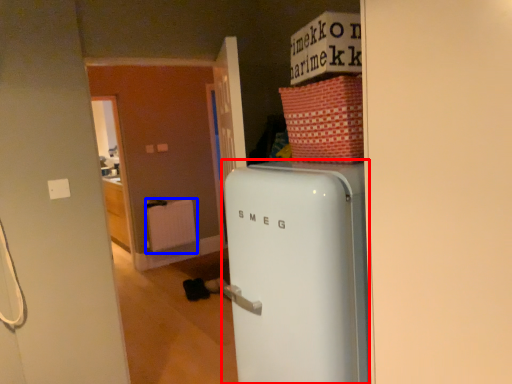
Question: Among these objects, which one is nearest to the camera, refrigerator (highlighted by a red box) or radiator (highlighted by a blue box)?

Choices:
 (A) refrigerator
 (B) radiator

Answer: (A)